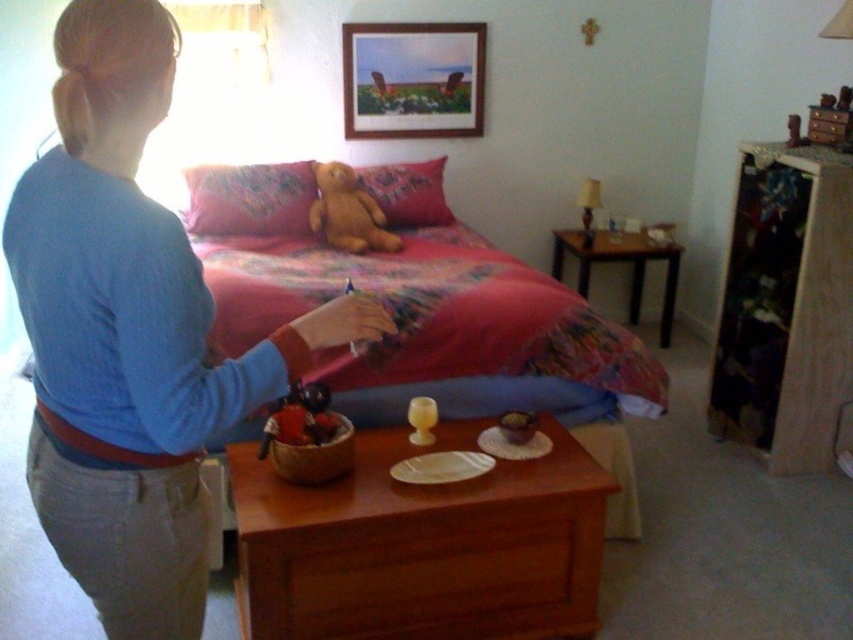
Is point (169, 268) positioned behind point (447, 376)?

No.

Does blue cotton shirt at upper left appear under fluffy fabric bed at center?

Yes.

Locate an element on the screen. The width and height of the screenshot is (853, 640). blue cotton shirt at upper left is located at coordinates (131, 333).